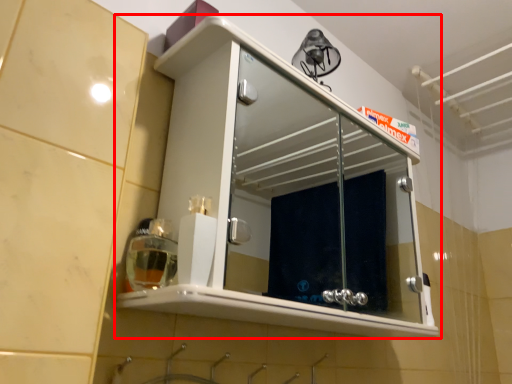
Question: In this image, where is cabinetry (annotated by the red box) located relative to soap dispenser?

Choices:
 (A) left
 (B) right

Answer: (B)